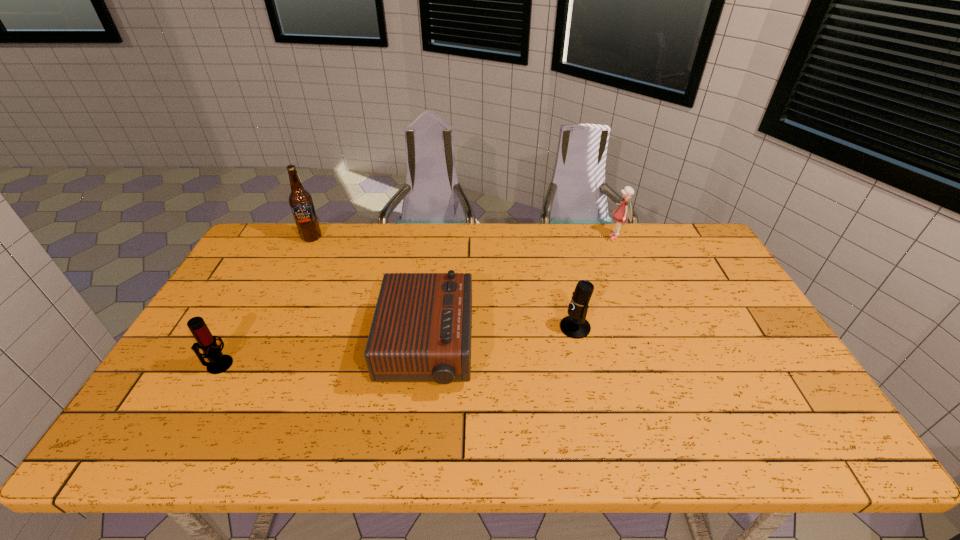
Find the location of `vacant area between the tallest object and the doll`. vacant area between the tallest object and the doll is located at coordinates coord(464,237).

At what (x,y) coordinates should I click in order to perform the action: click on vacant space that is in between the radio receiver and the second tallest object. Please return your answer as a coordinate pair (x, y). Looking at the image, I should click on (521, 293).

Identify the location of free area in between the right microphone and the radio receiver. (x=501, y=338).

I want to click on free area in between the beer bottle and the radio receiver, so click(370, 293).

Identify the location of the closest object relative to the nearer microphone. This screenshot has width=960, height=540. (421, 330).

In order to click on object that stands as the third closest to the right microphone in this screenshot , I will do `click(301, 203)`.

Find the location of a particular element. This screenshot has height=540, width=960. vacant space that satisfies the following two spatial constraints: 1. on the label of the tallest object; 2. on the right side of the second object from right to left is located at coordinates (268, 327).

Identify the location of free space that satisfies the following two spatial constraints: 1. on the front-facing side of the second tallest object; 2. on the label of the beer bottle. Image resolution: width=960 pixels, height=540 pixels. (616, 238).